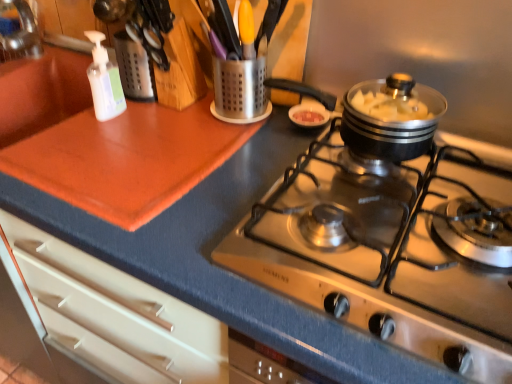
Question: Does metallic utensil holder at upper center have a greater width compared to stainless steel cooktop at center?

Choices:
 (A) no
 (B) yes

Answer: (A)

Question: Does metallic utensil holder at upper center contain stainless steel cooktop at center?

Choices:
 (A) no
 (B) yes

Answer: (A)

Question: Is metallic utensil holder at upper center not within stainless steel cooktop at center?

Choices:
 (A) no
 (B) yes

Answer: (B)

Question: From the image's perspective, is metallic utensil holder at upper center on top of stainless steel cooktop at center?

Choices:
 (A) no
 (B) yes

Answer: (B)

Question: Is metallic utensil holder at upper center positioned with its back to stainless steel cooktop at center?

Choices:
 (A) yes
 (B) no

Answer: (B)

Question: Does metallic utensil holder at upper center come behind stainless steel cooktop at center?

Choices:
 (A) yes
 (B) no

Answer: (A)

Question: Is metallic utensil holder at upper center not within white translucent bottle at upper left?

Choices:
 (A) no
 (B) yes

Answer: (B)

Question: Is metallic utensil holder at upper center to the right of white translucent bottle at upper left from the viewer's perspective?

Choices:
 (A) no
 (B) yes

Answer: (B)

Question: Is the depth of metallic utensil holder at upper center greater than that of white translucent bottle at upper left?

Choices:
 (A) no
 (B) yes

Answer: (B)

Question: From a real-world perspective, is metallic utensil holder at upper center over white translucent bottle at upper left?

Choices:
 (A) no
 (B) yes

Answer: (A)

Question: Is metallic utensil holder at upper center beside white translucent bottle at upper left?

Choices:
 (A) yes
 (B) no

Answer: (B)

Question: Considering the relative positions of metallic utensil holder at upper center and white translucent bottle at upper left in the image provided, is metallic utensil holder at upper center to the left of white translucent bottle at upper left from the viewer's perspective?

Choices:
 (A) yes
 (B) no

Answer: (B)

Question: From a real-world perspective, is stainless steel cooktop at center on white translucent bottle at upper left?

Choices:
 (A) no
 (B) yes

Answer: (A)